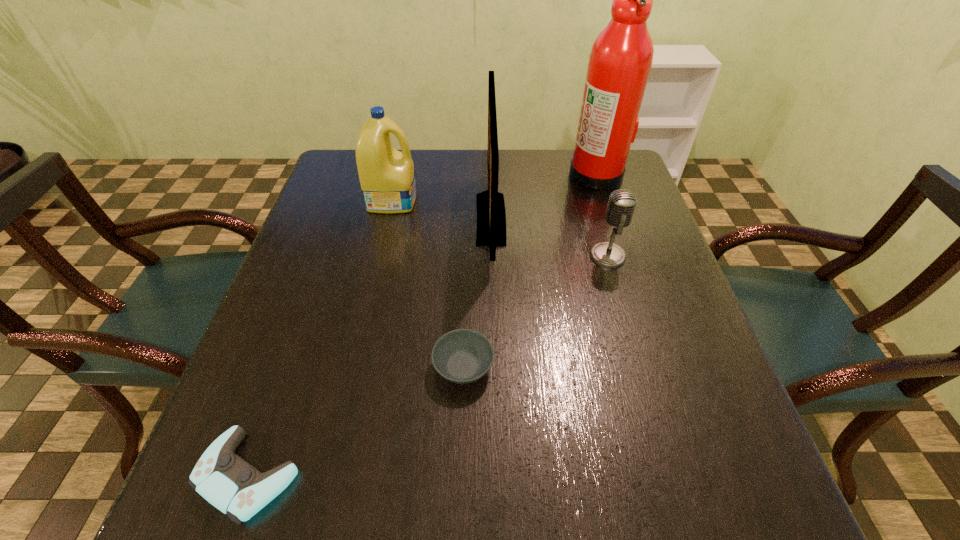
Where is `detergent positioned at the left edge`? Image resolution: width=960 pixels, height=540 pixels. detergent positioned at the left edge is located at coordinates (387, 178).

The height and width of the screenshot is (540, 960). Find the location of `control present at the left edge`. control present at the left edge is located at coordinates (228, 482).

Identify the location of fire extinguisher present at the right edge. (620, 61).

You are a GUI agent. You are given a task and a screenshot of the screen. Output one action in this format:
    pyautogui.click(x=<x>, y=<y>)
    Task: Click on the microphone at the right edge
    The width and height of the screenshot is (960, 540).
    Given the screenshot: What is the action you would take?
    pyautogui.click(x=622, y=202)

What are the coordinates of `object that is at the far left corner` in the screenshot? It's located at (387, 178).

This screenshot has height=540, width=960. Identify the location of object present at the near left corner. (228, 482).

You are a GUI agent. You are given a task and a screenshot of the screen. Output one action in this format:
    pyautogui.click(x=<x>, y=<y>)
    Task: Click on the object located at the far right corner
    Image resolution: width=960 pixels, height=540 pixels.
    Given the screenshot: What is the action you would take?
    pyautogui.click(x=620, y=61)

You are a GUI agent. You are given a task and a screenshot of the screen. Output one action in this format:
    pyautogui.click(x=<x>, y=<y>)
    Task: Click on the free space at the far edge of the desktop
    The width and height of the screenshot is (960, 540).
    Given the screenshot: What is the action you would take?
    pyautogui.click(x=573, y=190)

Image resolution: width=960 pixels, height=540 pixels. Identify the location of vacant space at the near edge of the desktop. (511, 511).

Locate an element on the screen. The height and width of the screenshot is (540, 960). blank area at the left edge is located at coordinates (331, 227).